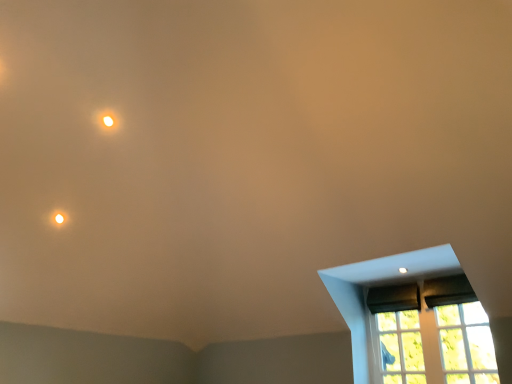
This screenshot has height=384, width=512. I want to click on matte black window at lower right, so click(379, 283).

The width and height of the screenshot is (512, 384). What are the coordinates of `matte white light at upper left` in the screenshot? It's located at (108, 120).

Find the location of `clear glass window at lower right, which appears as the second glass window when viewed from the right`. clear glass window at lower right, which appears as the second glass window when viewed from the right is located at coordinates coord(401,348).

Can you tell me how much transparent glass window at lower right, the first glass window when ordered from right to left, and matte black window at lower right differ in facing direction?

transparent glass window at lower right, the first glass window when ordered from right to left, and matte black window at lower right are facing 0.00229 degrees away from each other.

Considering the relative positions of transparent glass window at lower right, the second glass window positioned from the left, and matte black window at lower right in the image provided, is transparent glass window at lower right, the second glass window positioned from the left, to the right of matte black window at lower right from the viewer's perspective?

Yes.

Looking at this image, is transparent glass window at lower right, the first glass window when ordered from right to left, not within matte black window at lower right?

That's incorrect, transparent glass window at lower right, the first glass window when ordered from right to left, is not completely outside matte black window at lower right.

Is transparent glass window at lower right, the first glass window when ordered from right to left, aimed at matte black window at lower right?

No, transparent glass window at lower right, the first glass window when ordered from right to left, is not aimed at matte black window at lower right.

Is matte white light at upper left directly adjacent to transparent glass window at lower right, the second glass window positioned from the left?

No, matte white light at upper left is not in contact with transparent glass window at lower right, the second glass window positioned from the left.

Which is more to the right, matte white light at upper left or transparent glass window at lower right, the second glass window positioned from the left?

transparent glass window at lower right, the second glass window positioned from the left.

Looking at their sizes, would you say matte white light at upper left is wider or thinner than transparent glass window at lower right, the second glass window positioned from the left?

matte white light at upper left is thinner than transparent glass window at lower right, the second glass window positioned from the left.

Where is `glass window below the transparent glass window at lower right, the first glass window when ordered from right to left (from a real-world perspective)`? This screenshot has width=512, height=384. glass window below the transparent glass window at lower right, the first glass window when ordered from right to left (from a real-world perspective) is located at coordinates (401, 348).

Is clear glass window at lower right, the first glass window when ordered from left to right, turned away from transparent glass window at lower right, the second glass window positioned from the left?

No.

From a real-world perspective, which is physically above, clear glass window at lower right, which appears as the second glass window when viewed from the right, or transparent glass window at lower right, the first glass window when ordered from right to left?

transparent glass window at lower right, the first glass window when ordered from right to left, from a real-world perspective.

Can you confirm if clear glass window at lower right, the first glass window when ordered from left to right, is positioned to the right of transparent glass window at lower right, the first glass window when ordered from right to left?

Incorrect, clear glass window at lower right, the first glass window when ordered from left to right, is not on the right side of transparent glass window at lower right, the first glass window when ordered from right to left.

From a real-world perspective, is matte black window at lower right located beneath clear glass window at lower right, the first glass window when ordered from left to right?

No, from a real-world perspective, matte black window at lower right is not below clear glass window at lower right, the first glass window when ordered from left to right.

Considering the relative sizes of matte black window at lower right and clear glass window at lower right, which appears as the second glass window when viewed from the right, in the image provided, is matte black window at lower right shorter than clear glass window at lower right, which appears as the second glass window when viewed from the right,?

Incorrect, the height of matte black window at lower right does not fall short of that of clear glass window at lower right, which appears as the second glass window when viewed from the right.

Is matte black window at lower right spatially inside clear glass window at lower right, which appears as the second glass window when viewed from the right, or outside of it?

matte black window at lower right is not enclosed by clear glass window at lower right, which appears as the second glass window when viewed from the right.

In the image, is matte black window at lower right positioned in front of or behind clear glass window at lower right, the first glass window when ordered from left to right?

Clearly, matte black window at lower right is in front of clear glass window at lower right, the first glass window when ordered from left to right.

Is clear glass window at lower right, the first glass window when ordered from left to right, at the back of transparent glass window at lower right, the first glass window when ordered from right to left?

No, transparent glass window at lower right, the first glass window when ordered from right to left, is not facing the opposite direction of clear glass window at lower right, the first glass window when ordered from left to right.

Relative to clear glass window at lower right, the first glass window when ordered from left to right, is transparent glass window at lower right, the first glass window when ordered from right to left, in front or behind?

transparent glass window at lower right, the first glass window when ordered from right to left, is positioned closer to the viewer than clear glass window at lower right, the first glass window when ordered from left to right.

From a real-world perspective, who is located lower, transparent glass window at lower right, the first glass window when ordered from right to left, or clear glass window at lower right, which appears as the second glass window when viewed from the right?

clear glass window at lower right, which appears as the second glass window when viewed from the right.

From the image's perspective, is transparent glass window at lower right, the second glass window positioned from the left, positioned above or below clear glass window at lower right, the first glass window when ordered from left to right?

Clearly, from the image's perspective, transparent glass window at lower right, the second glass window positioned from the left, is above clear glass window at lower right, the first glass window when ordered from left to right.

Who is more distant, matte white light at upper left or matte black window at lower right?

matte white light at upper left is more distant.

Between point (103, 124) and point (452, 262), which one is positioned behind?

The point (103, 124) is more distant.

Does matte white light at upper left have a lesser height compared to matte black window at lower right?

Yes.

Are clear glass window at lower right, which appears as the second glass window when viewed from the right, and matte black window at lower right beside each other?

clear glass window at lower right, which appears as the second glass window when viewed from the right, and matte black window at lower right are clearly separated.

From the picture: Choose the correct answer: Is clear glass window at lower right, which appears as the second glass window when viewed from the right, inside matte black window at lower right or outside it?

clear glass window at lower right, which appears as the second glass window when viewed from the right, is contained in matte black window at lower right.

Which of these two, clear glass window at lower right, the first glass window when ordered from left to right, or matte black window at lower right, is bigger?

Bigger between the two is matte black window at lower right.

This screenshot has width=512, height=384. Find the location of `window located in front of the clear glass window at lower right, which appears as the second glass window when viewed from the right`. window located in front of the clear glass window at lower right, which appears as the second glass window when viewed from the right is located at coordinates (379, 283).

Identify the location of glass window lying above the matte black window at lower right (from the image's perspective). This screenshot has height=384, width=512. (466, 344).

Where is `the 1st glass window located beneath the matte white light at upper left (from a real-world perspective)`? The height and width of the screenshot is (384, 512). the 1st glass window located beneath the matte white light at upper left (from a real-world perspective) is located at coordinates (466, 344).

Considering their positions, is matte white light at upper left positioned further to clear glass window at lower right, which appears as the second glass window when viewed from the right, than transparent glass window at lower right, the second glass window positioned from the left?

matte white light at upper left.

Considering their positions, is clear glass window at lower right, the first glass window when ordered from left to right, positioned further to matte white light at upper left than transparent glass window at lower right, the second glass window positioned from the left?

transparent glass window at lower right, the second glass window positioned from the left, is positioned further to the anchor matte white light at upper left.

Which object lies nearer to the anchor point matte black window at lower right, transparent glass window at lower right, the first glass window when ordered from right to left, or clear glass window at lower right, the first glass window when ordered from left to right?

Among the two, clear glass window at lower right, the first glass window when ordered from left to right, is located nearer to matte black window at lower right.

Estimate the real-world distances between objects in this image. Which object is further from clear glass window at lower right, which appears as the second glass window when viewed from the right, matte white light at upper left or matte black window at lower right?

The object further to clear glass window at lower right, which appears as the second glass window when viewed from the right, is matte white light at upper left.

From the image, which object appears to be nearer to matte white light at upper left, transparent glass window at lower right, the first glass window when ordered from right to left, or matte black window at lower right?

Based on the image, matte black window at lower right appears to be nearer to matte white light at upper left.

Looking at the image, which one is located further to matte black window at lower right, matte white light at upper left or transparent glass window at lower right, the second glass window positioned from the left?

matte white light at upper left is further to matte black window at lower right.

Estimate the real-world distances between objects in this image. Which object is further from transparent glass window at lower right, the second glass window positioned from the left, matte white light at upper left or matte black window at lower right?

matte white light at upper left lies further to transparent glass window at lower right, the second glass window positioned from the left, than the other object.

From the image, which object appears to be nearer to transparent glass window at lower right, the first glass window when ordered from right to left, matte white light at upper left or clear glass window at lower right, the first glass window when ordered from left to right?

clear glass window at lower right, the first glass window when ordered from left to right, lies closer to transparent glass window at lower right, the first glass window when ordered from right to left, than the other object.

Locate an element on the screen. This screenshot has height=384, width=512. glass window situated between matte white light at upper left and transparent glass window at lower right, the first glass window when ordered from right to left, from left to right is located at coordinates (401, 348).

Identify the location of window positioned between transparent glass window at lower right, the first glass window when ordered from right to left, and clear glass window at lower right, which appears as the second glass window when viewed from the right, from near to far. The image size is (512, 384). (379, 283).

The image size is (512, 384). What are the coordinates of `window located between matte white light at upper left and transparent glass window at lower right, the second glass window positioned from the left, in the left-right direction` in the screenshot? It's located at (379, 283).

Identify the location of glass window located between matte white light at upper left and matte black window at lower right in the left-right direction. Image resolution: width=512 pixels, height=384 pixels. (401, 348).